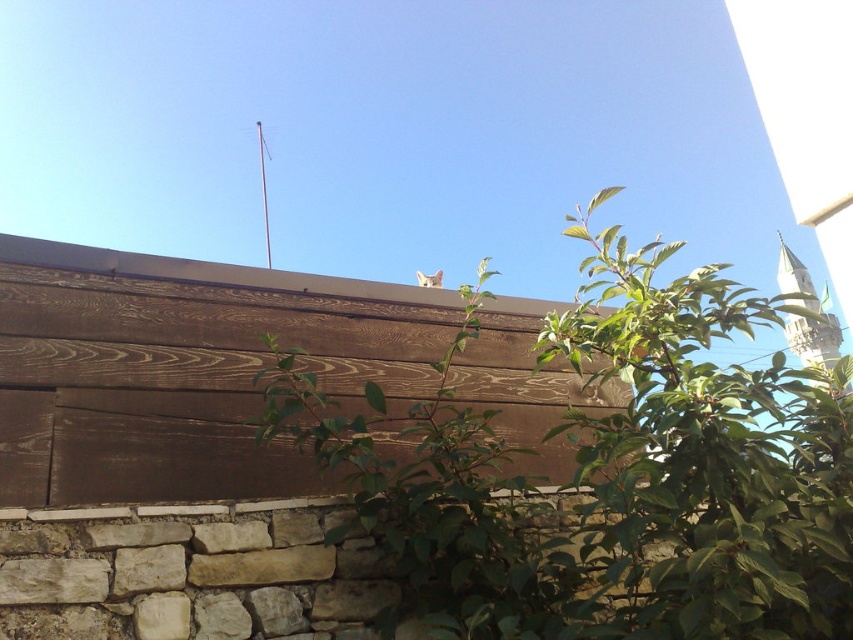
Question: Is green leafy plant at upper center positioned behind brown wood plank at upper center?

Choices:
 (A) no
 (B) yes

Answer: (A)

Question: Which point is closer to the camera taking this photo?

Choices:
 (A) (389, 364)
 (B) (715, 280)

Answer: (B)

Question: Is the position of green leafy plant at upper center more distant than that of brown wood plank at upper center?

Choices:
 (A) yes
 (B) no

Answer: (B)

Question: Does green leafy plant at upper center have a lesser width compared to brown wood plank at upper center?

Choices:
 (A) yes
 (B) no

Answer: (B)